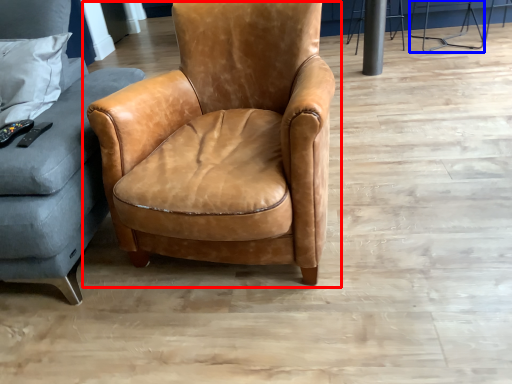
Question: Which of the following is the farthest to the observer, chair (highlighted by a red box) or bar stool (highlighted by a blue box)?

Choices:
 (A) chair
 (B) bar stool

Answer: (B)